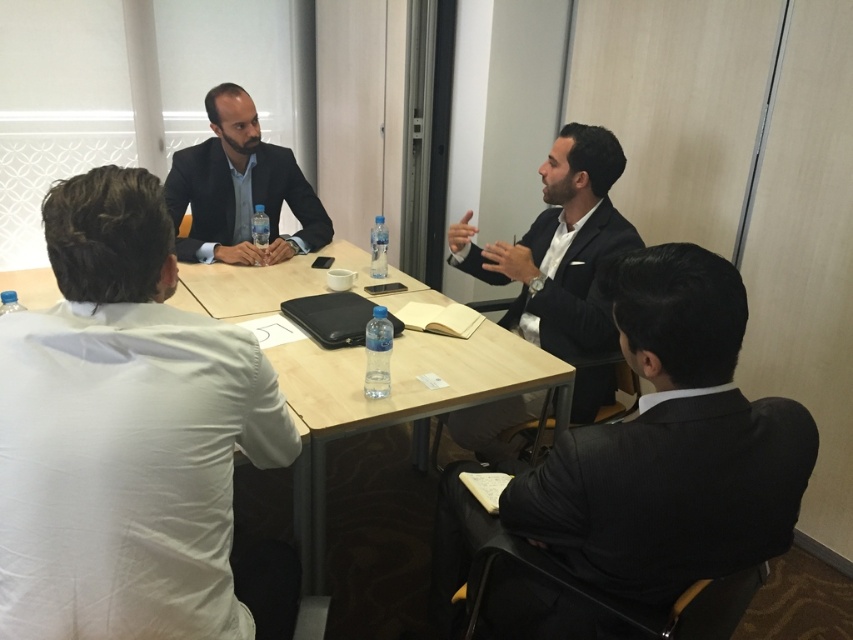
Question: Is white cotton shirt at left further to the viewer compared to black glossy suit at center?

Choices:
 (A) yes
 (B) no

Answer: (B)

Question: Is white cotton shirt at left further to the viewer compared to matte black suit at center?

Choices:
 (A) no
 (B) yes

Answer: (A)

Question: Which object is the farthest from the wooden table at center?

Choices:
 (A) black glossy suit at center
 (B) white cotton shirt at left
 (C) matte black suit at center

Answer: (B)

Question: Does black suit at lower right have a larger size compared to black glossy suit at center?

Choices:
 (A) no
 (B) yes

Answer: (B)

Question: Among these objects, which one is nearest to the camera?

Choices:
 (A) wooden table at center
 (B) white cotton shirt at left
 (C) black suit at lower right

Answer: (B)

Question: Which object appears closest to the camera in this image?

Choices:
 (A) black suit at lower right
 (B) black glossy suit at center

Answer: (A)